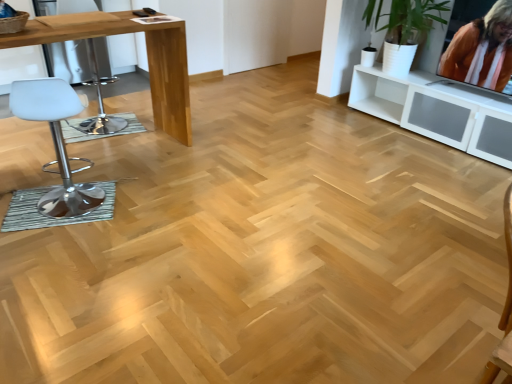
Question: Relative to light brown glossy table at left, is orange fabric at upper right in front or behind?

Choices:
 (A) front
 (B) behind

Answer: (B)

Question: Is orange fabric at upper right inside the boundaries of light brown glossy table at left, or outside?

Choices:
 (A) outside
 (B) inside

Answer: (A)

Question: Which object is positioned farthest from the white plastic swivel chair at left?

Choices:
 (A) light brown glossy table at left
 (B) orange fabric at upper right
 (C) white leather stool at left

Answer: (B)

Question: Based on their relative distances, which object is nearer to the orange fabric at upper right?

Choices:
 (A) white leather stool at left
 (B) white plastic swivel chair at left
 (C) light brown glossy table at left

Answer: (C)